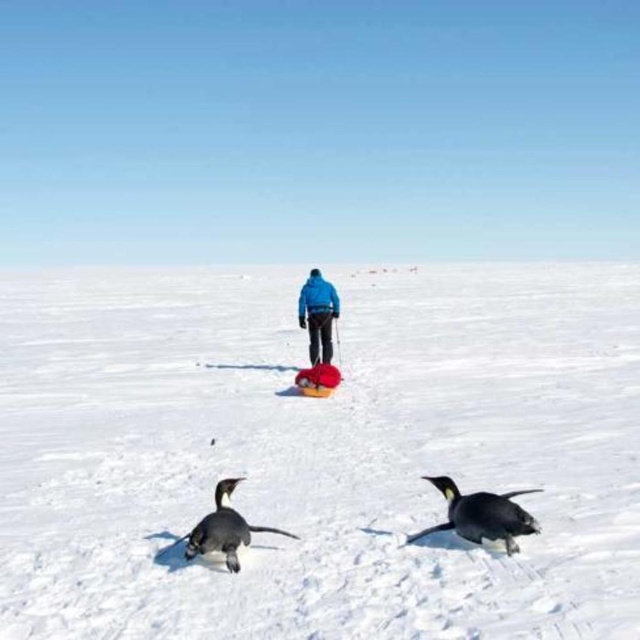
Question: Does white fluffy snow at center appear over black matte penguin at lower right?

Choices:
 (A) no
 (B) yes

Answer: (B)

Question: Which of these objects is positioned closest to the white fluffy snow at center?

Choices:
 (A) black matte penguin at lower right
 (B) blue fabric jacket at center

Answer: (B)

Question: Is black matte penguin at lower right to the left of black glossy penguin at lower left from the viewer's perspective?

Choices:
 (A) yes
 (B) no

Answer: (B)

Question: Among these points, which one is nearest to the camera?

Choices:
 (A) (232, 550)
 (B) (532, 516)
 (C) (316, 276)
 (D) (257, 355)

Answer: (A)

Question: Which object is closer to the camera taking this photo?

Choices:
 (A) black glossy penguin at lower left
 (B) black matte penguin at lower right
 (C) white fluffy snow at center

Answer: (C)

Question: Does black matte penguin at lower right have a larger size compared to black glossy penguin at lower left?

Choices:
 (A) yes
 (B) no

Answer: (B)